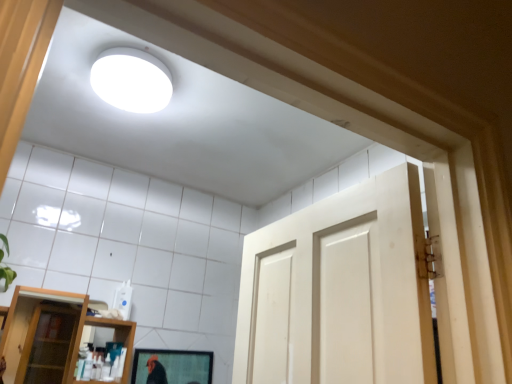
Question: Would you consider matte black mirror at lower center to be distant from transparent glass shelf at lower left?

Choices:
 (A) yes
 (B) no

Answer: (A)

Question: Is matte black mirror at lower center wider than transparent glass shelf at lower left?

Choices:
 (A) no
 (B) yes

Answer: (A)

Question: From a real-world perspective, is matte black mirror at lower center on transparent glass shelf at lower left?

Choices:
 (A) no
 (B) yes

Answer: (A)

Question: Considering the relative sizes of matte black mirror at lower center and transparent glass shelf at lower left in the image provided, is matte black mirror at lower center taller than transparent glass shelf at lower left?

Choices:
 (A) yes
 (B) no

Answer: (B)

Question: Can you confirm if matte black mirror at lower center is positioned to the right of transparent glass shelf at lower left?

Choices:
 (A) no
 (B) yes

Answer: (B)

Question: Is matte black mirror at lower center with transparent glass shelf at lower left?

Choices:
 (A) yes
 (B) no

Answer: (B)

Question: Is white matte light fixture at upper center far from transparent glass shelf at lower left?

Choices:
 (A) yes
 (B) no

Answer: (A)

Question: Can we say white matte light fixture at upper center lies outside transparent glass shelf at lower left?

Choices:
 (A) no
 (B) yes

Answer: (B)

Question: Is white matte light fixture at upper center smaller than transparent glass shelf at lower left?

Choices:
 (A) yes
 (B) no

Answer: (A)

Question: From a real-world perspective, does white matte light fixture at upper center stand above transparent glass shelf at lower left?

Choices:
 (A) yes
 (B) no

Answer: (A)

Question: From the image's perspective, is white matte light fixture at upper center on transparent glass shelf at lower left?

Choices:
 (A) yes
 (B) no

Answer: (A)

Question: Can you confirm if white matte light fixture at upper center is bigger than transparent glass shelf at lower left?

Choices:
 (A) yes
 (B) no

Answer: (B)

Question: Can you confirm if transparent glass shelf at lower left is bigger than matte black mirror at lower center?

Choices:
 (A) no
 (B) yes

Answer: (B)